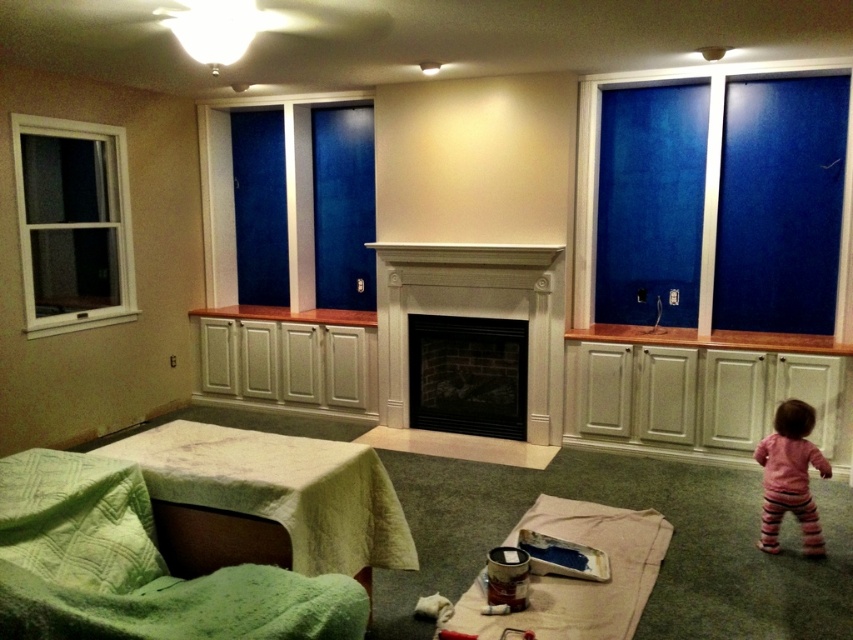
Does white frame window at left appear on the right side of pink striped pants at lower right?

In fact, white frame window at left is to the left of pink striped pants at lower right.

Can you confirm if white frame window at left is positioned to the left of pink striped pants at lower right?

Correct, you'll find white frame window at left to the left of pink striped pants at lower right.

The image size is (853, 640). I want to click on white frame window at left, so click(x=73, y=224).

The width and height of the screenshot is (853, 640). What are the coordinates of `white frame window at left` in the screenshot? It's located at (73, 224).

Who is more forward, (44,204) or (514,387)?

Point (44,204)

The image size is (853, 640). Find the location of `white frame window at left`. white frame window at left is located at coordinates (73, 224).

Between white wood fireplace at center and pink striped pants at lower right, which one appears on the right side from the viewer's perspective?

From the viewer's perspective, pink striped pants at lower right appears more on the right side.

Who is higher up, white wood fireplace at center or pink striped pants at lower right?

Positioned higher is white wood fireplace at center.

Which is behind, point (515, 268) or point (816, 465)?

The point (515, 268) is more distant.

At what (x,y) coordinates should I click in order to perform the action: click on white wood fireplace at center. Please return your answer as a coordinate pair (x, y). Looking at the image, I should click on (473, 316).